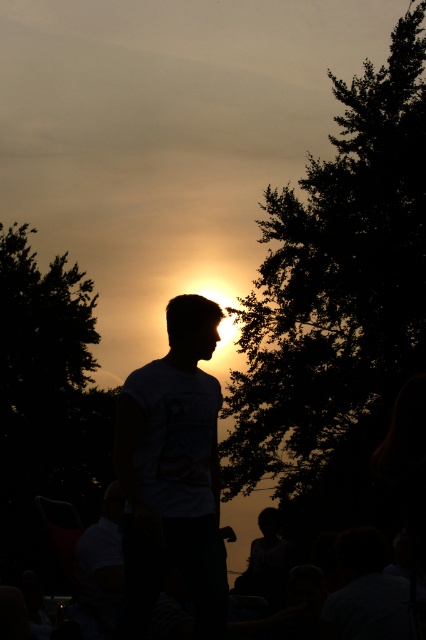
Does dark green leafy tree at right appear under silhouette t-shirt at center?

Indeed, dark green leafy tree at right is positioned under silhouette t-shirt at center.

Between dark green leafy tree at right and silhouette t-shirt at center, which one is positioned higher?

silhouette t-shirt at center is above.

Does point (273, 397) lie behind point (189, 476)?

That is True.

This screenshot has width=426, height=640. What are the coordinates of `dark green leafy tree at right` in the screenshot? It's located at (x=337, y=305).

Is point (319, 508) closer to viewer compared to point (86, 595)?

That is False.

Between dark green leafy tree at right and silhouette crowd at center, which one has less height?

silhouette crowd at center

Between point (365, 385) and point (74, 528), which one is positioned behind?

Positioned behind is point (365, 385).

Locate an element on the screen. dark green leafy tree at right is located at coordinates (337, 305).

What do you see at coordinates (172, 474) in the screenshot? I see `silhouette t-shirt at center` at bounding box center [172, 474].

Can you confirm if silhouette t-shirt at center is bigger than silhouette crowd at center?

Yes, silhouette t-shirt at center is bigger than silhouette crowd at center.

Locate an element on the screen. This screenshot has width=426, height=640. silhouette t-shirt at center is located at coordinates (172, 474).

Image resolution: width=426 pixels, height=640 pixels. In order to click on silhouette t-shirt at center in this screenshot , I will do `click(172, 474)`.